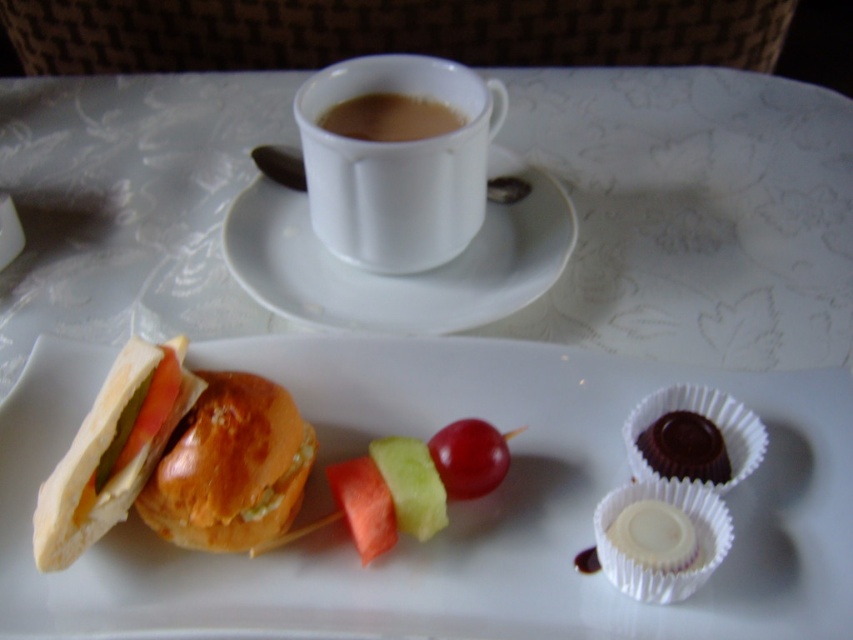
You are a GUI agent. You are given a task and a screenshot of the screen. Output one action in this format:
    pyautogui.click(x=<x>, y=<y>)
    Task: Click on the white paper plate at center
    The height and width of the screenshot is (640, 853).
    Given the screenshot: What is the action you would take?
    pyautogui.click(x=450, y=506)

The height and width of the screenshot is (640, 853). What do you see at coordinates (450, 506) in the screenshot?
I see `white paper plate at center` at bounding box center [450, 506].

Does point (86, 376) lie in front of point (225, 472)?

That is False.

Where is `white paper plate at center`? Image resolution: width=853 pixels, height=640 pixels. white paper plate at center is located at coordinates (450, 506).

Measure the distance between point (635, 476) and camera.

A distance of 61.75 centimeters exists between point (635, 476) and camera.

Locate an element on the screen. The image size is (853, 640). smooth chocolate cupcake at lower right is located at coordinates (706, 419).

You are a GUI agent. You are given a task and a screenshot of the screen. Output one action in this format:
    pyautogui.click(x=<x>, y=<y>)
    Task: Click on the smooth chocolate cupcake at lower right
    
    Given the screenshot: What is the action you would take?
    [706, 419]

Is white chocolate cupcake at lower right further to camera compared to red shiny grape at center?

No, white chocolate cupcake at lower right is in front of red shiny grape at center.

From the picture: Who is more forward, (689,566) or (515,432)?

Point (689,566) is in front.

The height and width of the screenshot is (640, 853). What do you see at coordinates (660, 538) in the screenshot?
I see `white chocolate cupcake at lower right` at bounding box center [660, 538].

Find the location of a particular element. Image resolution: width=853 pixels, height=640 pixels. white chocolate cupcake at lower right is located at coordinates (660, 538).